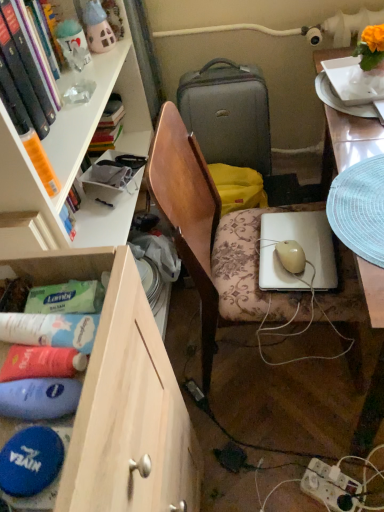
Question: From a real-world perspective, is wooden drawer at lower left positioned over matte gray suitcase at center based on gravity?

Choices:
 (A) yes
 (B) no

Answer: (B)

Question: Does wooden drawer at lower left have a smaller size compared to matte gray suitcase at center?

Choices:
 (A) no
 (B) yes

Answer: (A)

Question: Is wooden drawer at lower left shorter than matte gray suitcase at center?

Choices:
 (A) no
 (B) yes

Answer: (A)

Question: Can you confirm if wooden drawer at lower left is taller than matte gray suitcase at center?

Choices:
 (A) yes
 (B) no

Answer: (A)

Question: Can you confirm if wooden drawer at lower left is bigger than matte gray suitcase at center?

Choices:
 (A) yes
 (B) no

Answer: (A)

Question: From the image's perspective, would you say wooden drawer at lower left is positioned over matte gray suitcase at center?

Choices:
 (A) no
 (B) yes

Answer: (A)

Question: Considering the relative sizes of hardcover book at upper left and wooden drawer at lower left in the image provided, is hardcover book at upper left shorter than wooden drawer at lower left?

Choices:
 (A) no
 (B) yes

Answer: (B)

Question: Is hardcover book at upper left smaller than wooden drawer at lower left?

Choices:
 (A) yes
 (B) no

Answer: (A)

Question: Does hardcover book at upper left come in front of wooden drawer at lower left?

Choices:
 (A) no
 (B) yes

Answer: (A)

Question: Is hardcover book at upper left looking in the opposite direction of wooden drawer at lower left?

Choices:
 (A) no
 (B) yes

Answer: (A)

Question: Would you say wooden drawer at lower left is part of hardcover book at upper left's contents?

Choices:
 (A) yes
 (B) no

Answer: (B)

Question: From the image's perspective, would you say hardcover book at upper left is shown under wooden drawer at lower left?

Choices:
 (A) yes
 (B) no

Answer: (B)

Question: Is white glossy desk at right with white plastic power outlet at lower right?

Choices:
 (A) yes
 (B) no

Answer: (B)